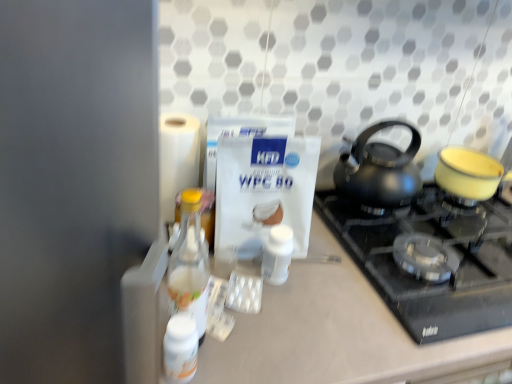
Find the location of a particular element. This screenshot has width=512, height=384. black matte kettle at upper right is located at coordinates (379, 171).

This screenshot has width=512, height=384. Find the location of `clear glass bottle at left, marked as the 2th bottle in a left-to-right arrangement`. clear glass bottle at left, marked as the 2th bottle in a left-to-right arrangement is located at coordinates (190, 264).

What do you see at coordinates (431, 282) in the screenshot?
I see `black glass gas stove at center` at bounding box center [431, 282].

Image resolution: width=512 pixels, height=384 pixels. What do you see at coordinates (345, 333) in the screenshot?
I see `white matte counter at center` at bounding box center [345, 333].

This screenshot has width=512, height=384. What do you see at coordinates (180, 348) in the screenshot?
I see `white glossy bottle at lower left, the second bottle positioned from the front` at bounding box center [180, 348].

Image resolution: width=512 pixels, height=384 pixels. In order to click on black matte kettle at upper right in this screenshot , I will do pyautogui.click(x=379, y=171).

Is yellow matte pot at upper right a part of black glass gas stove at center?

Actually, yellow matte pot at upper right is outside black glass gas stove at center.

From the image's perspective, is black glass gas stove at center located above or below yellow matte pot at upper right?

Clearly, from the image's perspective, black glass gas stove at center is below yellow matte pot at upper right.

Considering their positions, is black glass gas stove at center located in front of or behind yellow matte pot at upper right?

black glass gas stove at center is in front of yellow matte pot at upper right.

What's the angular difference between black glass gas stove at center and yellow matte pot at upper right's facing directions?

The angular difference between black glass gas stove at center and yellow matte pot at upper right is 20.3 degrees.

Can you see white glossy bottle at lower left, the first bottle from the left, touching black matte kettle at upper right?

No, white glossy bottle at lower left, the first bottle from the left, is not in contact with black matte kettle at upper right.

Between white glossy bottle at lower left, the 3th bottle in the right-to-left sequence, and black matte kettle at upper right, which one has less height?

With less height is white glossy bottle at lower left, the 3th bottle in the right-to-left sequence.

From a real-world perspective, who is located lower, white glossy bottle at lower left, the 3th bottle in the right-to-left sequence, or black matte kettle at upper right?

From a 3D spatial view, white glossy bottle at lower left, the 3th bottle in the right-to-left sequence, is below.

Could you tell me if white glossy bottle at lower left, the first bottle from the left, is turned towards black matte kettle at upper right?

No, white glossy bottle at lower left, the first bottle from the left, is not oriented towards black matte kettle at upper right.

From the picture: Is white matte counter at center looking in the opposite direction of white glossy bottle at lower left, the 3th bottle in the right-to-left sequence?

No, white matte counter at center is not facing the opposite direction of white glossy bottle at lower left, the 3th bottle in the right-to-left sequence.

Identify the location of counter that is under the white glossy bottle at lower left, the first bottle from the left (from a real-world perspective). Image resolution: width=512 pixels, height=384 pixels. (345, 333).

Between white matte counter at center and white glossy bottle at lower left, which ranks as the 2th bottle in back-to-front order, which one is positioned in front?

Positioned in front is white matte counter at center.

Is white matte counter at center smaller than white glossy bottle at lower left, the first bottle from the left?

Actually, white matte counter at center might be larger than white glossy bottle at lower left, the first bottle from the left.

Do you think black glass gas stove at center is within clear glass bottle at left, marked as the 2th bottle in a left-to-right arrangement, or outside of it?

black glass gas stove at center is not inside clear glass bottle at left, marked as the 2th bottle in a left-to-right arrangement, it's outside.

Is black glass gas stove at center smaller than clear glass bottle at left, the first bottle from the front?

No, black glass gas stove at center is not smaller than clear glass bottle at left, the first bottle from the front.

Can you confirm if black glass gas stove at center is wider than clear glass bottle at left, the second bottle in the right-to-left sequence?

Indeed, black glass gas stove at center has a greater width compared to clear glass bottle at left, the second bottle in the right-to-left sequence.

Can you tell me how much black glass gas stove at center and clear glass bottle at left, arranged as the third bottle when viewed from the back, differ in facing direction?

There is a 1.4-degree angle between the facing directions of black glass gas stove at center and clear glass bottle at left, arranged as the third bottle when viewed from the back.

Considering the relative positions of black glass gas stove at center and white glossy bottle at lower left, the first bottle from the left, in the image provided, is black glass gas stove at center to the left of white glossy bottle at lower left, the first bottle from the left, from the viewer's perspective?

Incorrect, black glass gas stove at center is not on the left side of white glossy bottle at lower left, the first bottle from the left.

Is black glass gas stove at center completely or partially outside of white glossy bottle at lower left, the first bottle from the left?

That's correct, black glass gas stove at center is outside of white glossy bottle at lower left, the first bottle from the left.

Who is taller, black glass gas stove at center or white glossy bottle at lower left, the 3th bottle in the right-to-left sequence?

white glossy bottle at lower left, the 3th bottle in the right-to-left sequence, is taller.

Which is in front, point (393, 239) or point (177, 315)?

The point (177, 315) is closer to the camera.

Is clear glass bottle at left, the second bottle in the right-to-left sequence, with white glossy bottle at lower left, which ranks as the 2th bottle in back-to-front order?

No, clear glass bottle at left, the second bottle in the right-to-left sequence, is not next to white glossy bottle at lower left, which ranks as the 2th bottle in back-to-front order.

Based on the photo, does clear glass bottle at left, arranged as the third bottle when viewed from the back, have a lesser width compared to white glossy bottle at lower left, the 3th bottle in the right-to-left sequence?

No.

Is point (177, 251) closer to camera compared to point (173, 346)?

No, (177, 251) is further to viewer.

Is clear glass bottle at left, the second bottle in the right-to-left sequence, looking in the opposite direction of white glossy bottle at lower left, the second bottle positioned from the front?

No, clear glass bottle at left, the second bottle in the right-to-left sequence, is not facing away from white glossy bottle at lower left, the second bottle positioned from the front.

Is black matte kettle at upper right next to clear glass bottle at left, arranged as the third bottle when viewed from the back, and touching it?

black matte kettle at upper right and clear glass bottle at left, arranged as the third bottle when viewed from the back, are clearly separated.

Between black matte kettle at upper right and clear glass bottle at left, the first bottle from the front, which one is positioned behind?

black matte kettle at upper right.

Which point is more forward, (377, 131) or (203, 309)?

The point (203, 309) is closer to the camera.

Could you measure the distance between black matte kettle at upper right and clear glass bottle at left, the second bottle in the right-to-left sequence?

18.31 inches.

Identify the location of appliance above the black glass gas stove at center (from a real-world perspective). The width and height of the screenshot is (512, 384). coord(467,174).

The image size is (512, 384). Find the location of `the 2nd bottle in front of the black matte kettle at upper right`. the 2nd bottle in front of the black matte kettle at upper right is located at coordinates (180, 348).

When comparing their distances from yellow matte pot at upper right, does white glossy bottle at lower left, the 3th bottle in the right-to-left sequence, or white matte toilet paper at left seem closer?

white matte toilet paper at left.

From the image, which object appears to be farther from clear glass bottle at left, marked as the 2th bottle in a left-to-right arrangement, yellow matte pot at upper right or white matte bottle at center, arranged as the 3th bottle when viewed from the left?

Among the two, yellow matte pot at upper right is located further to clear glass bottle at left, marked as the 2th bottle in a left-to-right arrangement.

Estimate the real-world distances between objects in this image. Which object is further from white matte toilet paper at left, black matte kettle at upper right or white matte counter at center?

black matte kettle at upper right.

Based on their spatial positions, is clear glass bottle at left, the first bottle from the front, or black matte kettle at upper right further from white matte toilet paper at left?

The object further to white matte toilet paper at left is black matte kettle at upper right.

From the image, which object appears to be nearer to clear glass bottle at left, marked as the 2th bottle in a left-to-right arrangement, black glass gas stove at center or white matte bottle at center, which is the 1th bottle from right to left?

white matte bottle at center, which is the 1th bottle from right to left.

Considering their positions, is white matte bottle at center, the 3th bottle viewed from the front, positioned further to white matte toilet paper at left than yellow matte pot at upper right?

Among the two, yellow matte pot at upper right is located further to white matte toilet paper at left.

Looking at the image, which one is located closer to black matte kettle at upper right, white matte counter at center or white matte bottle at center, arranged as the 3th bottle when viewed from the left?

The object closer to black matte kettle at upper right is white matte counter at center.

Estimate the real-world distances between objects in this image. Which object is further from clear glass bottle at left, the second bottle in the right-to-left sequence, black matte kettle at upper right or white glossy bottle at lower left, the first bottle from the left?

black matte kettle at upper right is positioned further to the anchor clear glass bottle at left, the second bottle in the right-to-left sequence.

This screenshot has width=512, height=384. I want to click on kettle between clear glass bottle at left, arranged as the third bottle when viewed from the back, and black glass gas stove at center, in the horizontal direction, so click(x=379, y=171).

Locate an element on the screen. This screenshot has width=512, height=384. counter between white matte toilet paper at left and yellow matte pot at upper right from left to right is located at coordinates (345, 333).

Where is `kettle between white matte toilet paper at left and black glass gas stove at center`? This screenshot has width=512, height=384. kettle between white matte toilet paper at left and black glass gas stove at center is located at coordinates (379, 171).

You are a GUI agent. You are given a task and a screenshot of the screen. Output one action in this format:
    pyautogui.click(x=<x>, y=<y>)
    Task: Click on the kettle located between white glossy bottle at lower left, the 3th bottle in the right-to-left sequence, and white matte counter at center in the left-right direction
    The image size is (512, 384).
    Given the screenshot: What is the action you would take?
    pyautogui.click(x=379, y=171)